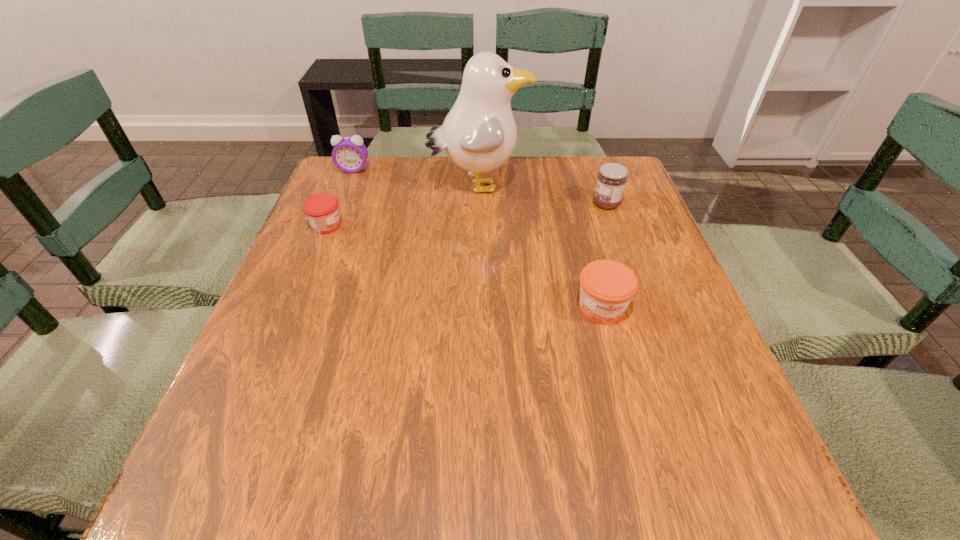
Find the location of a particular element. This screenshot has height=540, width=960. vacant point that satisfies the following two spatial constraints: 1. on the face of the alarm clock; 2. on the label side of the second nearest jam is located at coordinates (331, 226).

At what (x,y) coordinates should I click in order to perform the action: click on free region that satisfies the following two spatial constraints: 1. on the face of the alarm clock; 2. on the label side of the shortest jam. Please return your answer as a coordinate pair (x, y). This screenshot has width=960, height=540. Looking at the image, I should click on (331, 226).

Locate an element on the screen. The height and width of the screenshot is (540, 960). vacant point that satisfies the following two spatial constraints: 1. on the face of the alarm clock; 2. on the label side of the second nearest jam is located at coordinates (331, 226).

The width and height of the screenshot is (960, 540). Find the location of `free space that satisfies the following two spatial constraints: 1. on the face of the alarm clock; 2. on the label side of the leftmost jam`. free space that satisfies the following two spatial constraints: 1. on the face of the alarm clock; 2. on the label side of the leftmost jam is located at coordinates (331, 226).